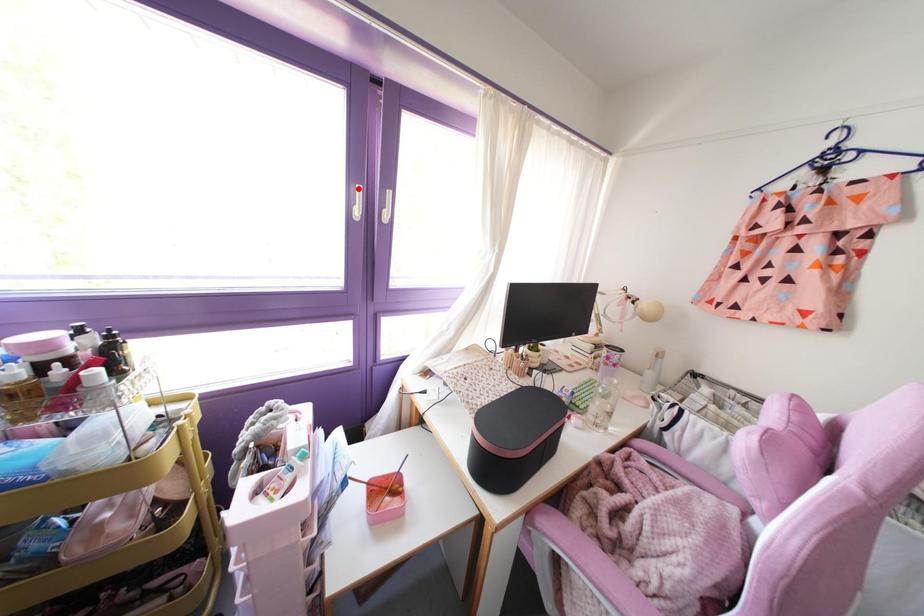
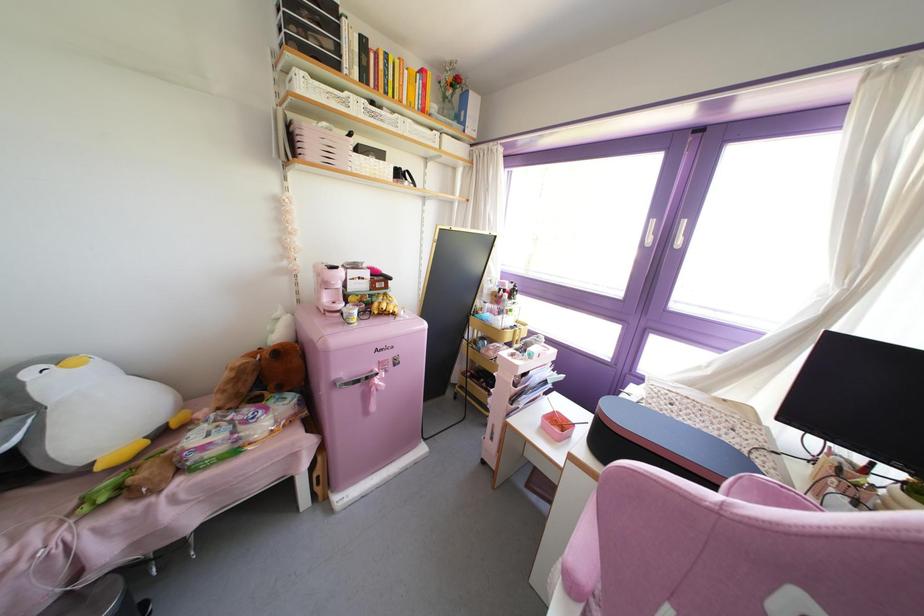
Question: I am providing you with two images of the same scene from different viewpoints. A red point is marked on the first image. At the location where the point appears in image 1, is it still visible in image 2?

Choices:
 (A) Yes
 (B) No

Answer: (A)